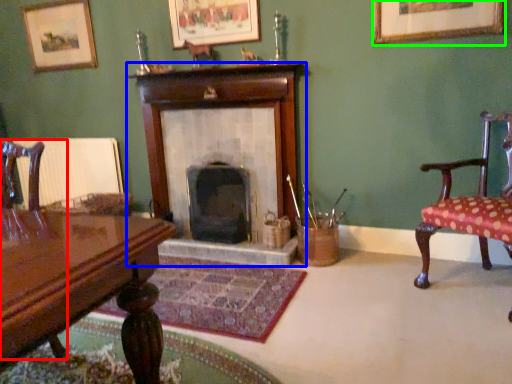
Question: Which object is the closest to the chair (highlighted by a red box)? Choose among these: fireplace (highlighted by a blue box) or picture frame (highlighted by a green box).

Choices:
 (A) fireplace
 (B) picture frame

Answer: (A)